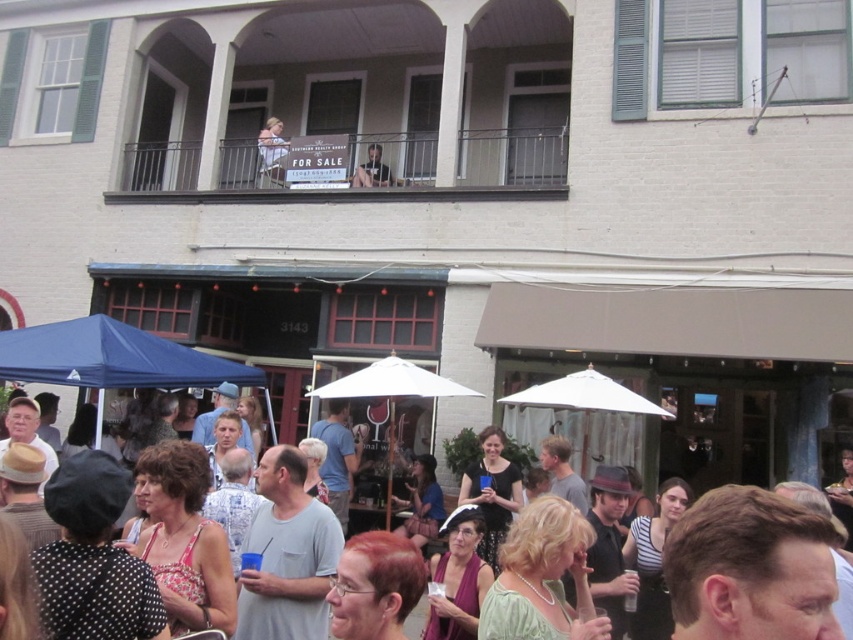
Question: Is matte black umbrella at center thinner than dark gray shirt at upper center?

Choices:
 (A) yes
 (B) no

Answer: (B)

Question: Based on their relative distances, which object is farther from the smooth skin face at upper center?

Choices:
 (A) dark gray shirt at upper center
 (B) metallic railing at upper center
 (C) blue fabric canopy at lower left

Answer: (C)

Question: Which of these objects is positioned farthest from the dark gray shirt at upper center?

Choices:
 (A) blue fabric canopy at lower left
 (B) smooth skin face at upper center
 (C) matte black umbrella at center

Answer: (C)

Question: Which object is farther from the camera taking this photo?

Choices:
 (A) matte black umbrella at center
 (B) smooth skin face at upper center
 (C) blue fabric canopy at lower left
 (D) metallic railing at upper center

Answer: (B)

Question: Does metallic railing at upper center appear under smooth skin face at upper center?

Choices:
 (A) no
 (B) yes

Answer: (B)

Question: Can you confirm if blue fabric canopy at lower left is bigger than smooth skin face at upper center?

Choices:
 (A) yes
 (B) no

Answer: (A)